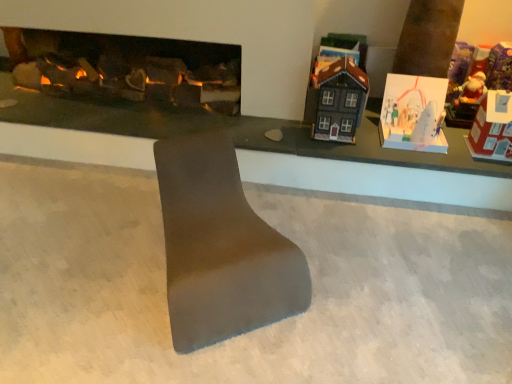
The height and width of the screenshot is (384, 512). What are the coordinates of `vacant area situated below white paper card at upper right, the 3th toy in the left-to-right sequence (from a real-world perspective)` in the screenshot? It's located at (401, 137).